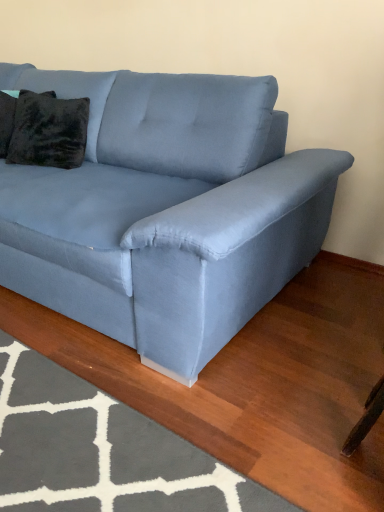
The image size is (384, 512). I want to click on gray textured rug at lower left, so click(x=101, y=450).

Image resolution: width=384 pixels, height=512 pixels. I want to click on velvet dark brown pillow at upper left, which is counted as the 2th pillow, starting from the left, so pos(44,130).

Locate an element on the screen. The image size is (384, 512). velvety black pillow at upper left, which is the second pillow from right to left is located at coordinates (6, 121).

This screenshot has height=512, width=384. Find the location of `gray textured rug at lower left`. gray textured rug at lower left is located at coordinates (101, 450).

Between point (2, 127) and point (145, 478), which one is positioned behind?

Point (2, 127)

Considering their positions, is velvety black pillow at upper left, which is the second pillow from right to left, located in front of or behind gray textured rug at lower left?

Clearly, velvety black pillow at upper left, which is the second pillow from right to left, is behind gray textured rug at lower left.

From a real-world perspective, is velvety black pillow at upper left, placed as the 1th pillow when sorted from left to right, positioned above or below gray textured rug at lower left?

velvety black pillow at upper left, placed as the 1th pillow when sorted from left to right, is above gray textured rug at lower left.

Can we say velvety black pillow at upper left, placed as the 1th pillow when sorted from left to right, lies outside gray textured rug at lower left?

velvety black pillow at upper left, placed as the 1th pillow when sorted from left to right, lies outside gray textured rug at lower left's area.

Which object is wider, velvet dark brown pillow at upper left, the 1th pillow when ordered from right to left, or light blue fabric couch at center?

light blue fabric couch at center.

Locate an element on the screen. pillow that is the 1st object located above the light blue fabric couch at center (from the image's perspective) is located at coordinates (44, 130).

From their relative heights in the image, would you say velvet dark brown pillow at upper left, the 1th pillow when ordered from right to left, is taller or shorter than light blue fabric couch at center?

Clearly, velvet dark brown pillow at upper left, the 1th pillow when ordered from right to left, is shorter compared to light blue fabric couch at center.

From the image's perspective, which object appears higher, velvet dark brown pillow at upper left, which is counted as the 2th pillow, starting from the left, or gray textured rug at lower left?

From the image's view, velvet dark brown pillow at upper left, which is counted as the 2th pillow, starting from the left, is above.

From a real-world perspective, does velvet dark brown pillow at upper left, the 1th pillow when ordered from right to left, stand above gray textured rug at lower left?

Yes.

Who is shorter, velvet dark brown pillow at upper left, which is counted as the 2th pillow, starting from the left, or gray textured rug at lower left?

With less height is gray textured rug at lower left.

Can you confirm if velvet dark brown pillow at upper left, which is counted as the 2th pillow, starting from the left, is positioned to the right of gray textured rug at lower left?

Incorrect, velvet dark brown pillow at upper left, which is counted as the 2th pillow, starting from the left, is not on the right side of gray textured rug at lower left.

Which of these two, light blue fabric couch at center or velvet dark brown pillow at upper left, which is counted as the 2th pillow, starting from the left, is smaller?

With smaller size is velvet dark brown pillow at upper left, which is counted as the 2th pillow, starting from the left.

In the image, is light blue fabric couch at center positioned in front of or behind velvet dark brown pillow at upper left, the 1th pillow when ordered from right to left?

Clearly, light blue fabric couch at center is in front of velvet dark brown pillow at upper left, the 1th pillow when ordered from right to left.

Identify the location of the 1st pillow behind when counting from the light blue fabric couch at center. (44, 130).

Is light blue fabric couch at center with velvet dark brown pillow at upper left, which is counted as the 2th pillow, starting from the left?

There is a gap between light blue fabric couch at center and velvet dark brown pillow at upper left, which is counted as the 2th pillow, starting from the left.

Which of these two, gray textured rug at lower left or velvet dark brown pillow at upper left, which is counted as the 2th pillow, starting from the left, is wider?

With larger width is gray textured rug at lower left.

Is gray textured rug at lower left situated inside velvet dark brown pillow at upper left, which is counted as the 2th pillow, starting from the left, or outside?

gray textured rug at lower left is spatially situated outside velvet dark brown pillow at upper left, which is counted as the 2th pillow, starting from the left.

Does gray textured rug at lower left lie in front of velvet dark brown pillow at upper left, the 1th pillow when ordered from right to left?

Yes.

Based on the photo, is gray textured rug at lower left looking in the opposite direction of velvety black pillow at upper left, which is the second pillow from right to left?

No.

From a real-world perspective, is gray textured rug at lower left physically below velvety black pillow at upper left, placed as the 1th pillow when sorted from left to right?

Correct, in the physical world, gray textured rug at lower left is lower than velvety black pillow at upper left, placed as the 1th pillow when sorted from left to right.

Which object is positioned more to the left, gray textured rug at lower left or velvety black pillow at upper left, placed as the 1th pillow when sorted from left to right?

velvety black pillow at upper left, placed as the 1th pillow when sorted from left to right.

Which point is more distant from viewer, (299, 509) or (11, 101)?

The point (11, 101) is farther from the camera.

Is velvety black pillow at upper left, placed as the 1th pillow when sorted from left to right, bigger than light blue fabric couch at center?

Incorrect, velvety black pillow at upper left, placed as the 1th pillow when sorted from left to right, is not larger than light blue fabric couch at center.

Is point (9, 104) farther from camera compared to point (43, 244)?

Yes, point (9, 104) is behind point (43, 244).

Could you tell me if velvety black pillow at upper left, which is the second pillow from right to left, is facing light blue fabric couch at center?

Yes, velvety black pillow at upper left, which is the second pillow from right to left, is aimed at light blue fabric couch at center.

From the image's perspective, is velvety black pillow at upper left, placed as the 1th pillow when sorted from left to right, located above or below light blue fabric couch at center?

From the image's perspective, velvety black pillow at upper left, placed as the 1th pillow when sorted from left to right, appears above light blue fabric couch at center.

This screenshot has width=384, height=512. What are the coordinates of `mat in front of the velvety black pillow at upper left, placed as the 1th pillow when sorted from left to right` in the screenshot? It's located at (101, 450).

You are a GUI agent. You are given a task and a screenshot of the screen. Output one action in this format:
    pyautogui.click(x=<x>, y=<y>)
    Task: Click on the studio couch below the velvet dark brown pillow at upper left, which is counted as the 2th pillow, starting from the left (from a real-world perspective)
    
    Given the screenshot: What is the action you would take?
    pyautogui.click(x=166, y=210)

From the picture: Looking at the image, which one is located further to gray textured rug at lower left, velvet dark brown pillow at upper left, the 1th pillow when ordered from right to left, or velvety black pillow at upper left, which is the second pillow from right to left?

The object further to gray textured rug at lower left is velvety black pillow at upper left, which is the second pillow from right to left.

Which object lies further to the anchor point velvet dark brown pillow at upper left, which is counted as the 2th pillow, starting from the left, gray textured rug at lower left or light blue fabric couch at center?

Based on the image, gray textured rug at lower left appears to be further to velvet dark brown pillow at upper left, which is counted as the 2th pillow, starting from the left.

Looking at the image, which one is located further to velvet dark brown pillow at upper left, which is counted as the 2th pillow, starting from the left, light blue fabric couch at center or velvety black pillow at upper left, placed as the 1th pillow when sorted from left to right?

The object further to velvet dark brown pillow at upper left, which is counted as the 2th pillow, starting from the left, is light blue fabric couch at center.

In the scene shown: Estimate the real-world distances between objects in this image. Which object is further from gray textured rug at lower left, light blue fabric couch at center or velvet dark brown pillow at upper left, which is counted as the 2th pillow, starting from the left?

velvet dark brown pillow at upper left, which is counted as the 2th pillow, starting from the left, is further to gray textured rug at lower left.

Looking at this image, considering their positions, is velvet dark brown pillow at upper left, the 1th pillow when ordered from right to left, positioned further to velvety black pillow at upper left, which is the second pillow from right to left, than gray textured rug at lower left?

gray textured rug at lower left.

Looking at this image, considering their positions, is gray textured rug at lower left positioned closer to velvety black pillow at upper left, placed as the 1th pillow when sorted from left to right, than velvet dark brown pillow at upper left, which is counted as the 2th pillow, starting from the left?

velvet dark brown pillow at upper left, which is counted as the 2th pillow, starting from the left.

Based on their spatial positions, is velvety black pillow at upper left, placed as the 1th pillow when sorted from left to right, or light blue fabric couch at center further from velvet dark brown pillow at upper left, the 1th pillow when ordered from right to left?

light blue fabric couch at center.

Which object lies further to the anchor point velvety black pillow at upper left, placed as the 1th pillow when sorted from left to right, light blue fabric couch at center or velvet dark brown pillow at upper left, which is counted as the 2th pillow, starting from the left?

Among the two, light blue fabric couch at center is located further to velvety black pillow at upper left, placed as the 1th pillow when sorted from left to right.

Find the location of `pillow between gray textured rug at lower left and velvety black pillow at upper left, placed as the 1th pillow when sorted from left to right, from front to back`. pillow between gray textured rug at lower left and velvety black pillow at upper left, placed as the 1th pillow when sorted from left to right, from front to back is located at coordinates (44, 130).

This screenshot has width=384, height=512. Find the location of `pillow between light blue fabric couch at center and velvety black pillow at upper left, which is the second pillow from right to left, along the z-axis`. pillow between light blue fabric couch at center and velvety black pillow at upper left, which is the second pillow from right to left, along the z-axis is located at coordinates (44, 130).

In order to click on studio couch between gray textured rug at lower left and velvet dark brown pillow at upper left, the 1th pillow when ordered from right to left, from front to back in this screenshot , I will do `click(166, 210)`.

At what (x,y) coordinates should I click in order to perform the action: click on studio couch located between gray textured rug at lower left and velvety black pillow at upper left, placed as the 1th pillow when sorted from left to right, in the depth direction. Please return your answer as a coordinate pair (x, y). Looking at the image, I should click on (166, 210).